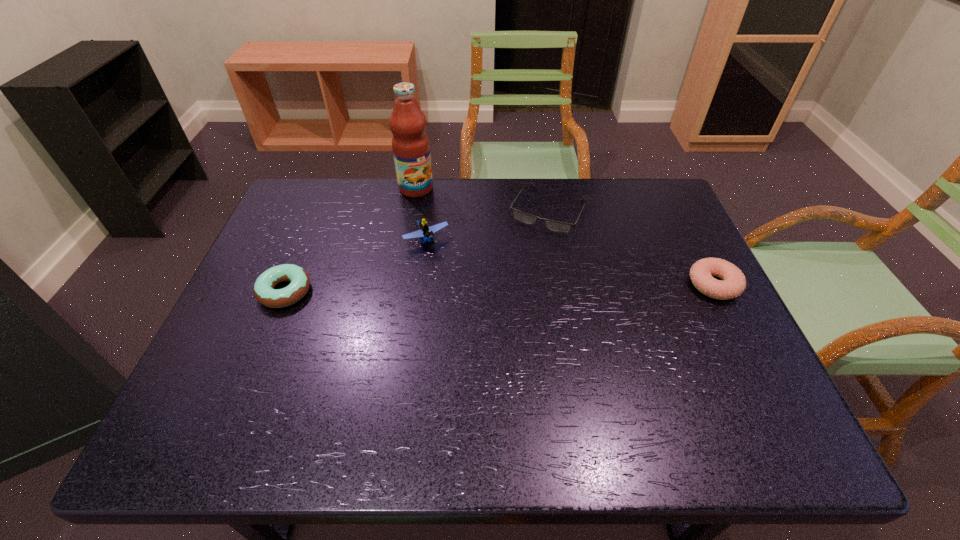
At what (x,y) coordinates should I click in order to perform the action: click on free space at the far edge. Please return your answer as a coordinate pair (x, y). Looking at the image, I should click on (618, 221).

In the image, there is a desktop. At what (x,y) coordinates should I click in order to perform the action: click on vacant space at the near edge. Please return your answer as a coordinate pair (x, y). The image size is (960, 540). Looking at the image, I should click on (407, 370).

Identify the location of vacant region at the left edge. This screenshot has width=960, height=540. tap(320, 258).

Where is `free location at the far left corner`? Image resolution: width=960 pixels, height=540 pixels. free location at the far left corner is located at coordinates (294, 202).

Identify the location of vacant region at the near left corner. This screenshot has height=540, width=960. (234, 398).

Locate an element on the screen. The width and height of the screenshot is (960, 540). free region at the far right corner is located at coordinates (655, 205).

What are the coordinates of `unoccupied position between the tallest object and the second object from right to left` in the screenshot? It's located at (482, 200).

Where is `empty space between the tallest object and the rightmost object`? This screenshot has height=540, width=960. empty space between the tallest object and the rightmost object is located at coordinates (564, 237).

Where is `free space that is in between the leftmost object and the tallest object`? This screenshot has height=540, width=960. free space that is in between the leftmost object and the tallest object is located at coordinates (350, 240).

This screenshot has height=540, width=960. In order to click on vacant area that lies between the fourth object from left to right and the left doughnut in this screenshot , I will do 417,251.